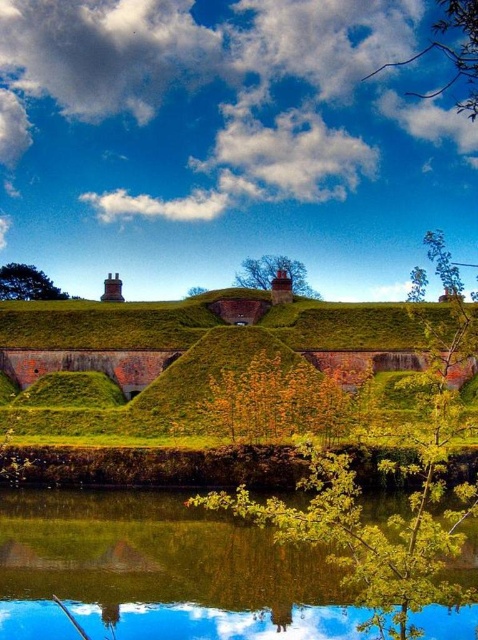
Does green leafy tree at center have a smaller size compared to green leafy tree at upper left?

Incorrect, green leafy tree at center is not smaller in size than green leafy tree at upper left.

Does green leafy tree at center have a larger size compared to green leafy tree at upper left?

Correct, green leafy tree at center is larger in size than green leafy tree at upper left.

Where is `green leafy tree at center`? This screenshot has width=478, height=640. green leafy tree at center is located at coordinates (273, 275).

Which is above, green grassy hillside at center or green leafy tree at center?

green leafy tree at center is above.

Between green grassy hillside at center and green leafy tree at center, which one is positioned lower?

Positioned lower is green grassy hillside at center.

This screenshot has height=640, width=478. Describe the element at coordinates (187, 348) in the screenshot. I see `green grassy hillside at center` at that location.

Locate an element on the screen. green grassy hillside at center is located at coordinates (187, 348).

Is green reflective water at lower center positioned at the back of green leafy tree at upper left?

That is False.

Who is more distant from viewer, (x=334, y=588) or (x=10, y=292)?

The point (x=10, y=292) is more distant.

Between point (17, 618) and point (11, 280), which one is positioned in front?

Positioned in front is point (17, 618).

Find the location of a particular element. green reflective water at lower center is located at coordinates (159, 572).